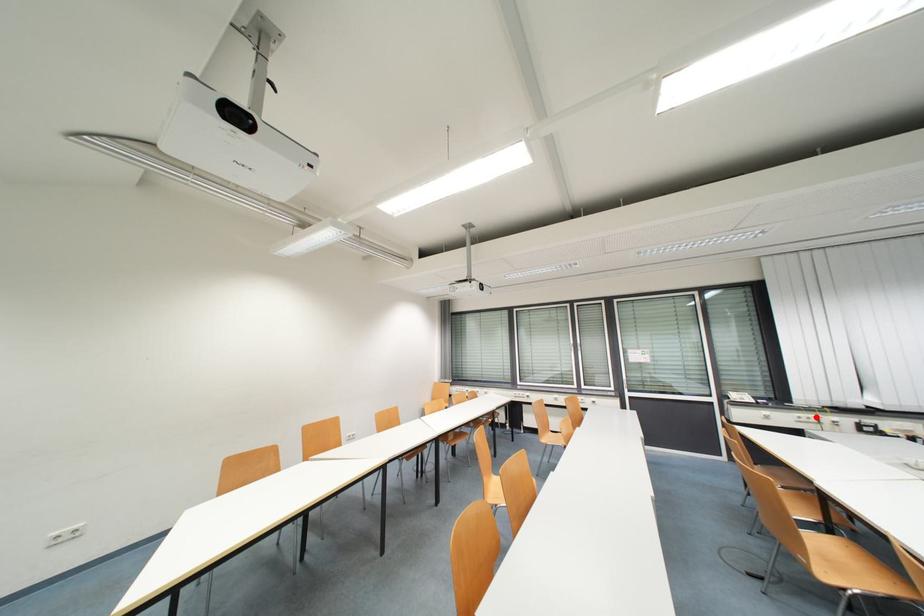
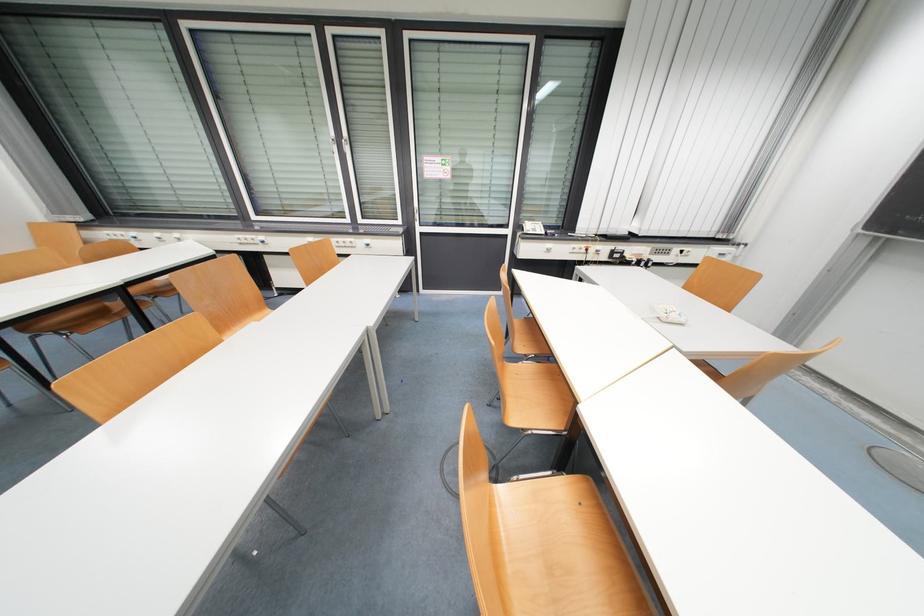
Question: I am providing you with two images of the same scene from different viewpoints. In image1, a red point is highlighted. Considering the same 3D point in image2, which of the following is correct?

Choices:
 (A) It is closer
 (B) It is farther

Answer: (A)